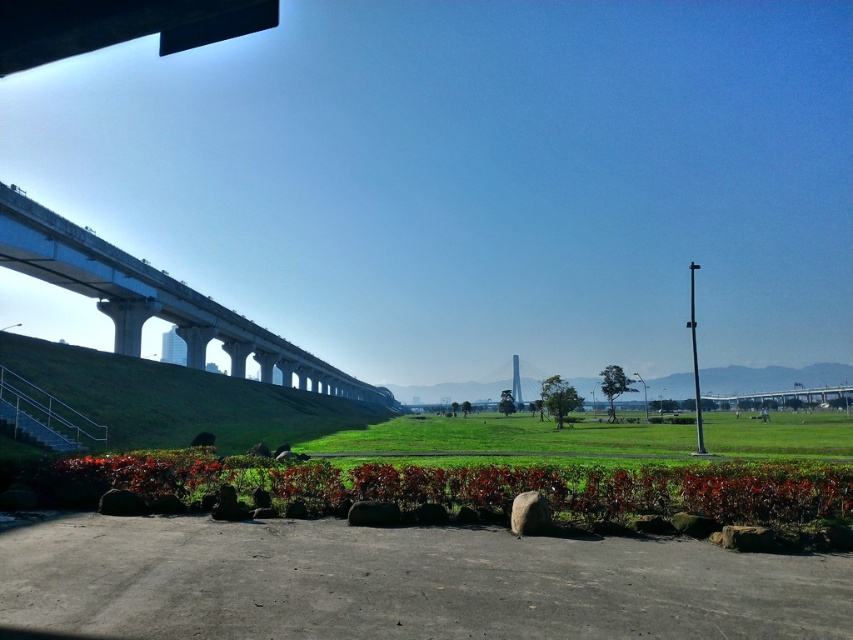
Which of these two, glossy red flower at lower center or white concrete pillar at center, stands taller?

white concrete pillar at center is taller.

Measure the distance between glossy red flower at lower center and white concrete pillar at center.

glossy red flower at lower center and white concrete pillar at center are 353.75 feet apart.

At what (x,y) coordinates should I click in order to perform the action: click on glossy red flower at lower center. Please return your answer as a coordinate pair (x, y). Looking at the image, I should click on (497, 484).

The width and height of the screenshot is (853, 640). Find the location of `glossy red flower at lower center`. glossy red flower at lower center is located at coordinates (497, 484).

Does green grassy hill at left have a greater width compared to concrete bridge at left?

No.

Which is behind, point (113, 433) or point (221, 340)?

The point (221, 340) is more distant.

Locate an element on the screen. This screenshot has width=853, height=640. green grassy hill at left is located at coordinates (178, 397).

You are a GUI agent. You are given a task and a screenshot of the screen. Output one action in this format:
    pyautogui.click(x=<x>, y=<y>)
    Task: Click on the green grassy hill at left
    Image resolution: width=853 pixels, height=640 pixels.
    Given the screenshot: What is the action you would take?
    pyautogui.click(x=178, y=397)

Can you confirm if concrete bridge at left is taller than white concrete pillar at center?

Indeed, concrete bridge at left has a greater height compared to white concrete pillar at center.

Looking at this image, is concrete bridge at left wider than white concrete pillar at center?

Yes, concrete bridge at left is wider than white concrete pillar at center.

Which is in front, point (379, 394) or point (512, 356)?

Point (512, 356) is in front.

Where is `concrete bridge at left`? concrete bridge at left is located at coordinates (154, 300).